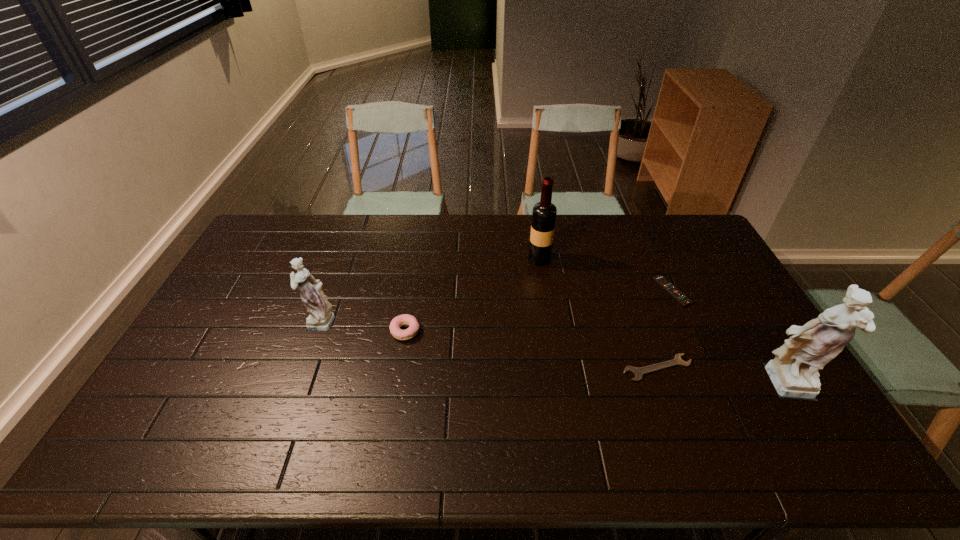
Where is `the third tallest object`? the third tallest object is located at coordinates (321, 317).

Locate an element on the screen. Image resolution: width=960 pixels, height=540 pixels. the leftmost object is located at coordinates (321, 317).

At what (x,y) coordinates should I click in order to perform the action: click on the nearer figurine. Please return your answer as a coordinate pair (x, y). The width and height of the screenshot is (960, 540). Looking at the image, I should click on (793, 372).

This screenshot has height=540, width=960. Identify the location of the right figurine. (793, 372).

Locate an element on the screen. the fifth nearest object is located at coordinates (660, 279).

Identify the location of wine bottle. The height and width of the screenshot is (540, 960). (544, 213).

I want to click on the fifth shortest object, so click(x=544, y=213).

This screenshot has width=960, height=540. Identify the location of wrench. (638, 372).

This screenshot has height=540, width=960. I want to click on doughnut, so click(x=405, y=319).

At what (x,y) coordinates should I click in order to perform the action: click on the fifth object from right to left. Please return your answer as a coordinate pair (x, y). Looking at the image, I should click on (405, 319).